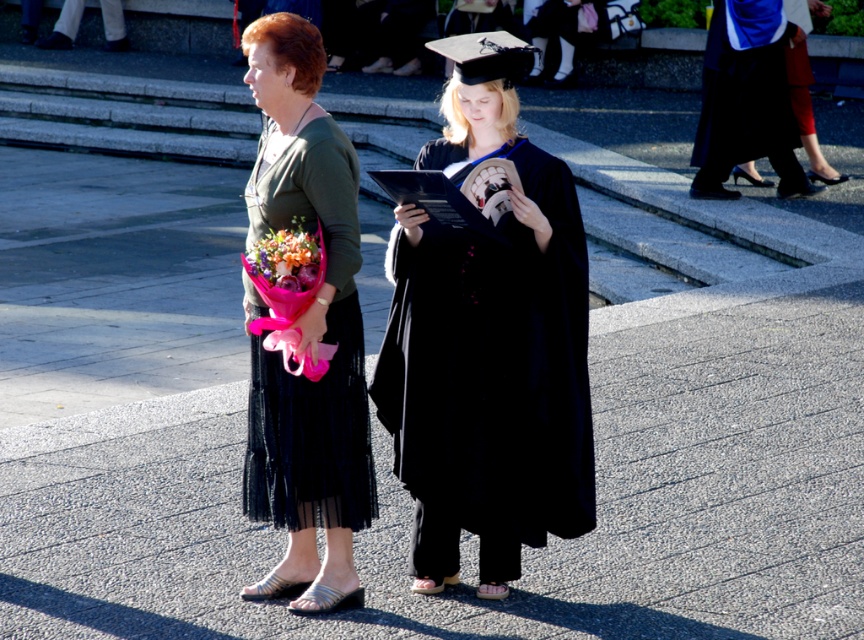
You are standing at the entrance of the ceremony area and want to take a photo of the matte black graduation gown at center. Based on its position, which direction should you move to frame it properly?

The matte black graduation gown at center is located at point coordinates, so you should move towards the center of the scene to frame it properly.

You are standing at the center of the image and want to place a small decoration exactly at point (488, 340). What object will the decoration land on?

The decoration will land on the matte black graduation gown at center because the point (488, 340) is on the matte black graduation gown at center.